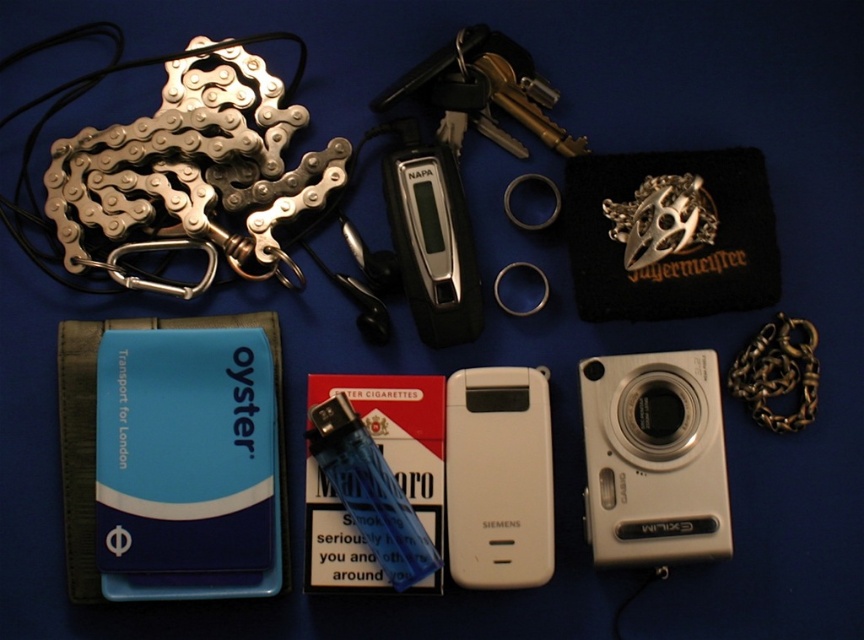
Does white plastic camera at lower right appear under white plastic phone at center?

Incorrect, white plastic camera at lower right is not positioned below white plastic phone at center.

Does white plastic camera at lower right have a lesser width compared to white plastic phone at center?

No.

At what (x,y) coordinates should I click in order to perform the action: click on white plastic camera at lower right. Please return your answer as a coordinate pair (x, y). Image resolution: width=864 pixels, height=640 pixels. Looking at the image, I should click on (653, 458).

Can you confirm if white plastic phone at center is positioned below gold metallic chain at right?

Indeed, white plastic phone at center is positioned under gold metallic chain at right.

Who is more distant from viewer, [445,410] or [761,413]?

The point [445,410] is behind.

Which is in front, point (530, 538) or point (777, 392)?

Point (777, 392) is more forward.

Where is `white plastic phone at center`? The height and width of the screenshot is (640, 864). white plastic phone at center is located at coordinates (499, 477).

Who is lower down, white plastic camera at lower right or gold metallic chain at right?

Positioned lower is white plastic camera at lower right.

Where is `white plastic camera at lower right`? white plastic camera at lower right is located at coordinates (x=653, y=458).